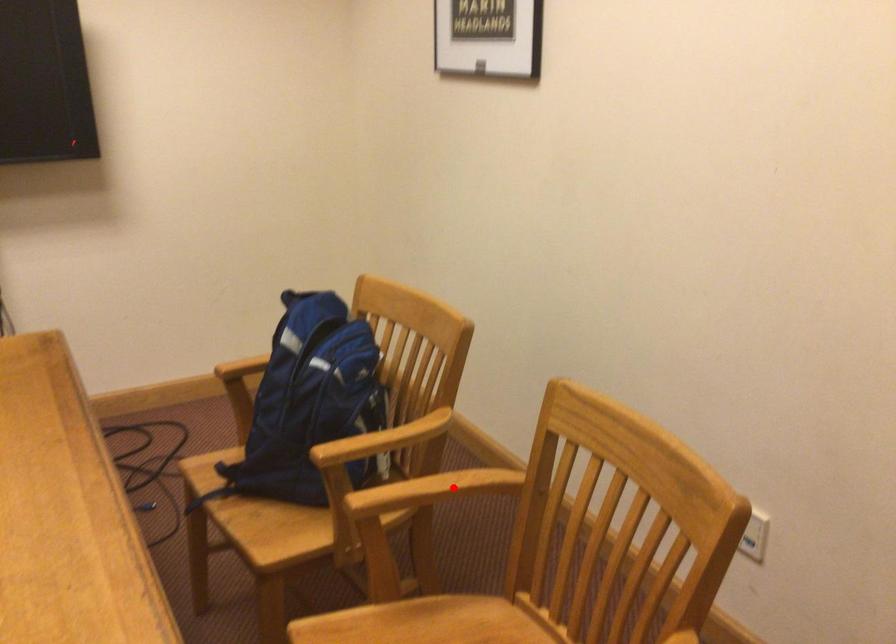
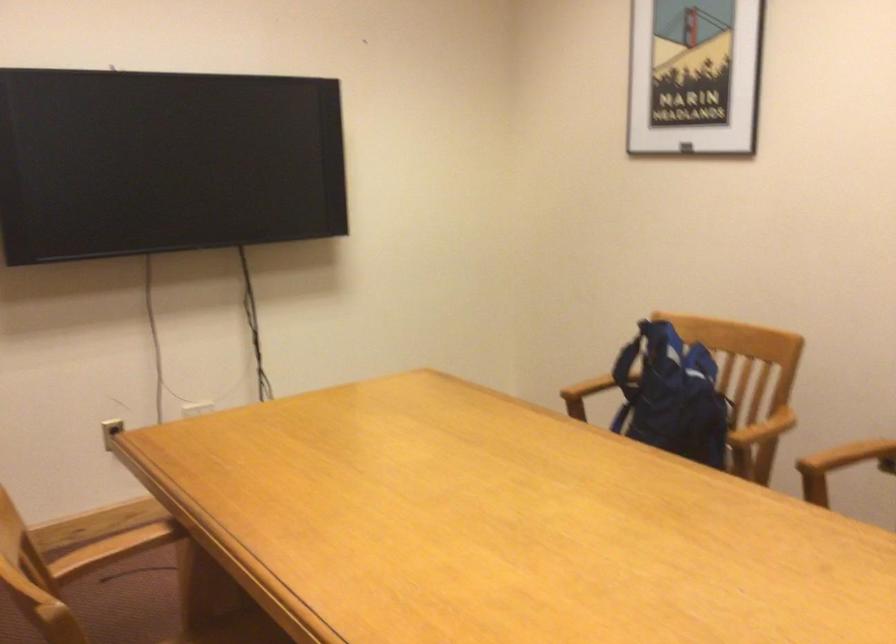
Question: A red point is marked in image1. In image2, is the corresponding 3D point closer to the camera or farther? Reply with the corresponding letter.

Choices:
 (A) The corresponding 3D point is closer.
 (B) The corresponding 3D point is farther.

Answer: (B)